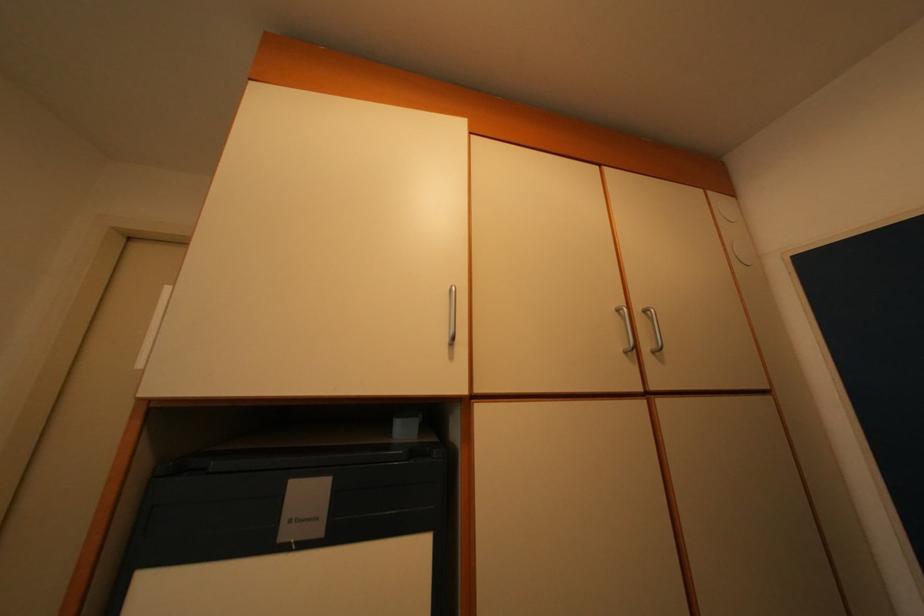
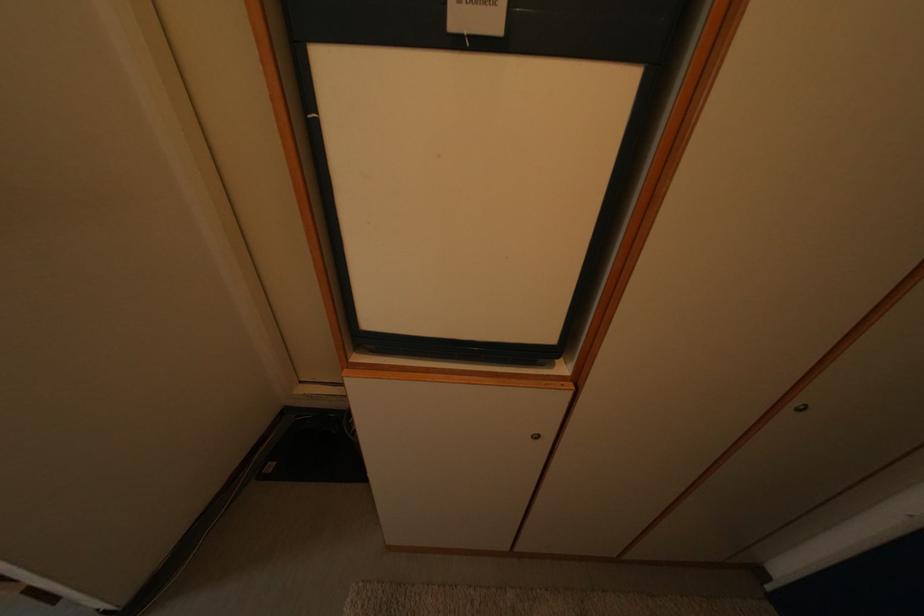
First-person continuous shooting, in which direction is the camera rotating?

The camera's rotation is toward left-down.